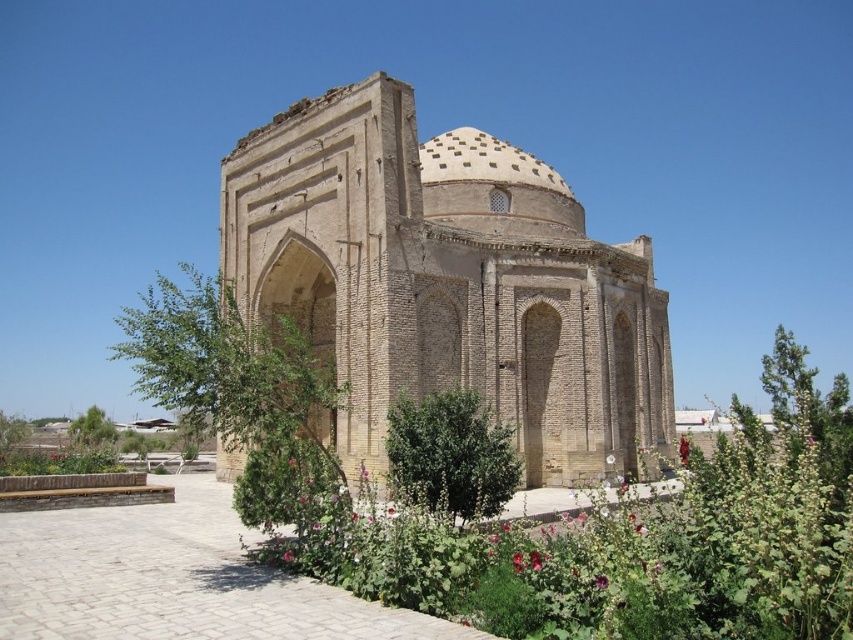
Question: Is brown brick dome at center bigger than green leafy plants at center?

Choices:
 (A) yes
 (B) no

Answer: (B)

Question: Where is brown brick dome at center located in relation to green leafy plants at center in the image?

Choices:
 (A) left
 (B) right

Answer: (A)

Question: Is brown brick dome at center positioned before green leafy plants at center?

Choices:
 (A) yes
 (B) no

Answer: (B)

Question: Which of the following is the farthest from the observer?

Choices:
 (A) green leafy plants at center
 (B) brown brick dome at center

Answer: (B)

Question: Which object appears farthest from the camera in this image?

Choices:
 (A) brown brick dome at center
 (B) green leafy plants at center

Answer: (A)